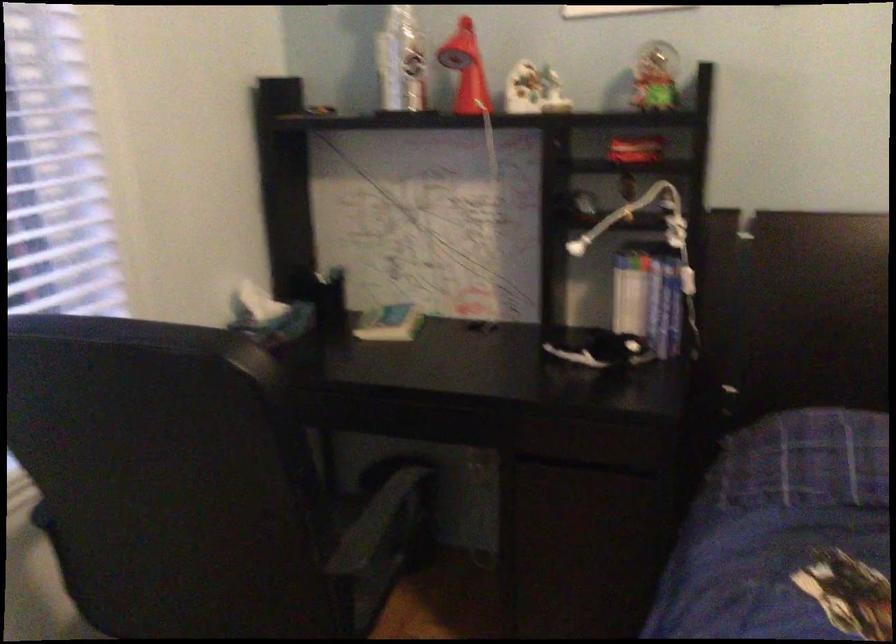
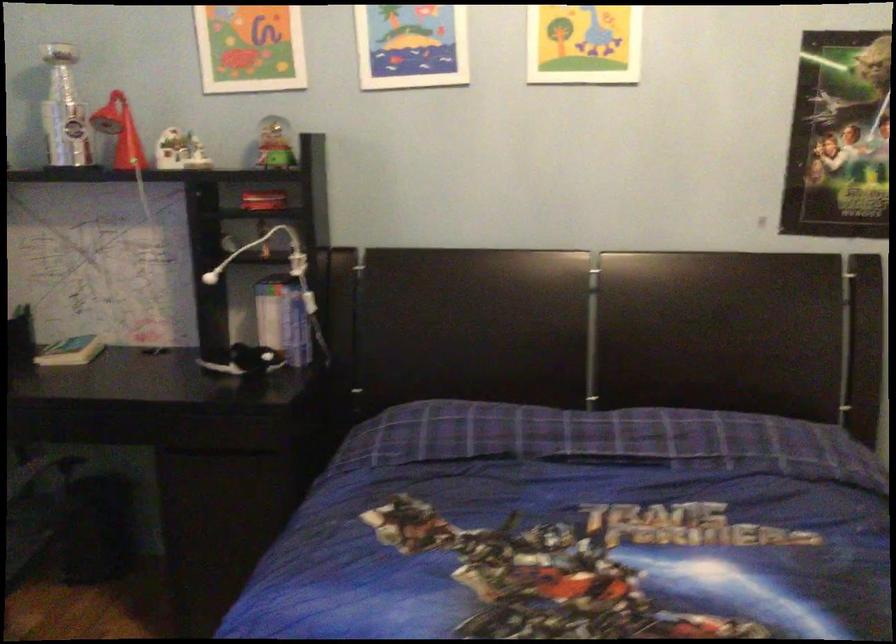
Question: The camera is either moving clockwise (left) or counter-clockwise (right) around the object. The first image is from the beginning of the video and the second image is from the end. Is the camera moving left or right when shooting the video?

Choices:
 (A) Left
 (B) Right

Answer: (A)